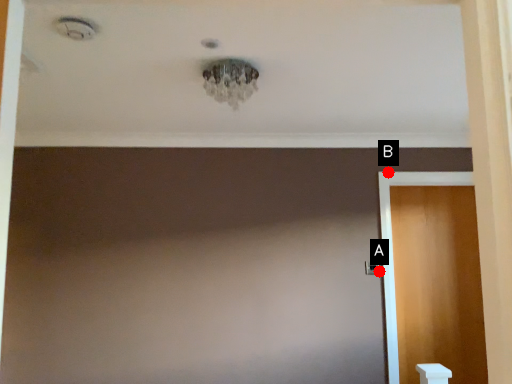
Question: Two points are circled on the image, labeled by A and B beside each circle. Among these points, which one is farthest from the camera?

Choices:
 (A) A is further
 (B) B is further

Answer: (B)